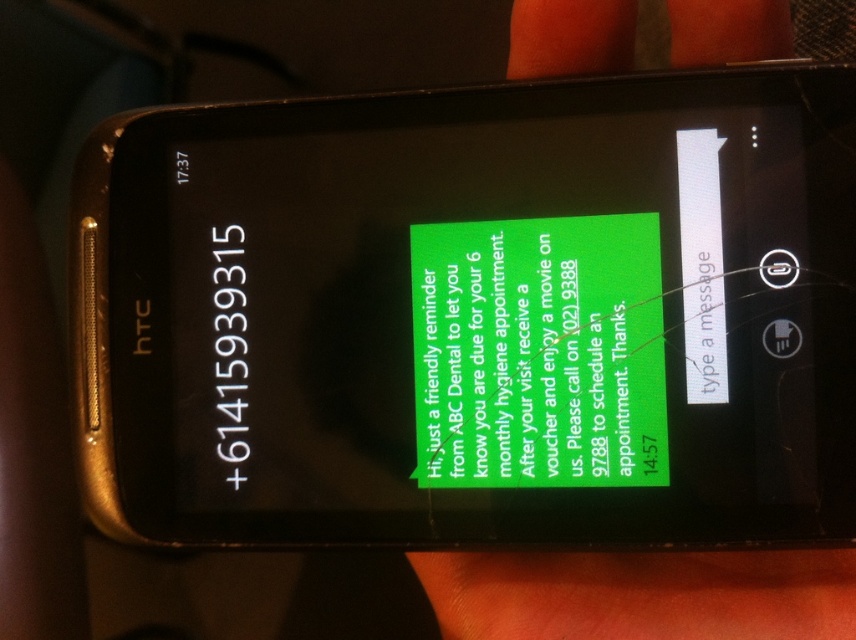
Does black plastic smartphone at center have a larger size compared to white matte text at upper right?

Yes.

Is the position of black plastic smartphone at center more distant than that of white matte text at upper right?

No.

Does point (125, 216) come in front of point (718, 365)?

No, (125, 216) is behind (718, 365).

This screenshot has height=640, width=856. In order to click on black plastic smartphone at center in this screenshot , I will do `click(474, 316)`.

Which is more to the right, black plastic smartphone at center or white glossy phone number at upper left?

Positioned to the right is black plastic smartphone at center.

Between black plastic smartphone at center and white glossy phone number at upper left, which one appears on the left side from the viewer's perspective?

Positioned to the left is white glossy phone number at upper left.

Between point (360, 141) and point (223, 243), which one is positioned in front?

Positioned in front is point (360, 141).

You are a GUI agent. You are given a task and a screenshot of the screen. Output one action in this format:
    pyautogui.click(x=<x>, y=<y>)
    Task: Click on the black plastic smartphone at center
    This screenshot has width=856, height=640.
    Given the screenshot: What is the action you would take?
    pyautogui.click(x=474, y=316)

Is point (227, 356) positioned before point (687, 333)?

No, it is not.

Is white glossy phone number at upper left positioned in front of white matte text at upper right?

No, it is not.

Is point (236, 227) farther from viewer compared to point (684, 301)?

Yes, it is behind point (684, 301).

Locate an element on the screen. white glossy phone number at upper left is located at coordinates (230, 349).